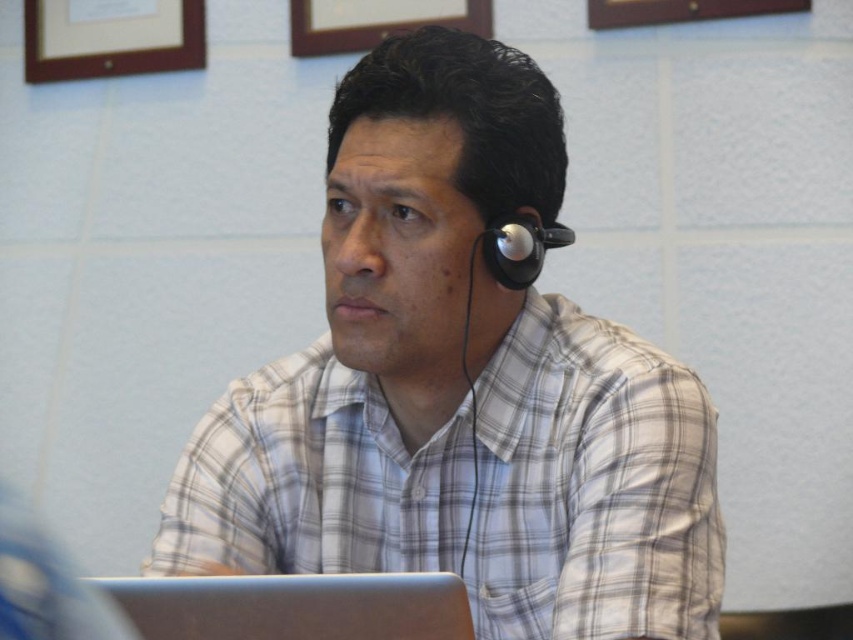
Question: Is silver metallic laptop at lower center bigger than wooden frame at upper left?

Choices:
 (A) no
 (B) yes

Answer: (A)

Question: Among these points, which one is nearest to the camera?

Choices:
 (A) (424, 620)
 (B) (178, 61)
 (C) (480, 632)

Answer: (A)

Question: Can you confirm if white checkered shirt at center is thinner than silver metallic laptop at lower center?

Choices:
 (A) no
 (B) yes

Answer: (A)

Question: Which object is positioned farthest from the wooden frame at upper left?

Choices:
 (A) white checkered shirt at center
 (B) silver metallic laptop at lower center

Answer: (B)

Question: Among these points, which one is farthest from the camera?

Choices:
 (A) (381, 307)
 (B) (285, 625)

Answer: (A)

Question: Does white checkered shirt at center have a larger size compared to silver metallic laptop at lower center?

Choices:
 (A) yes
 (B) no

Answer: (A)